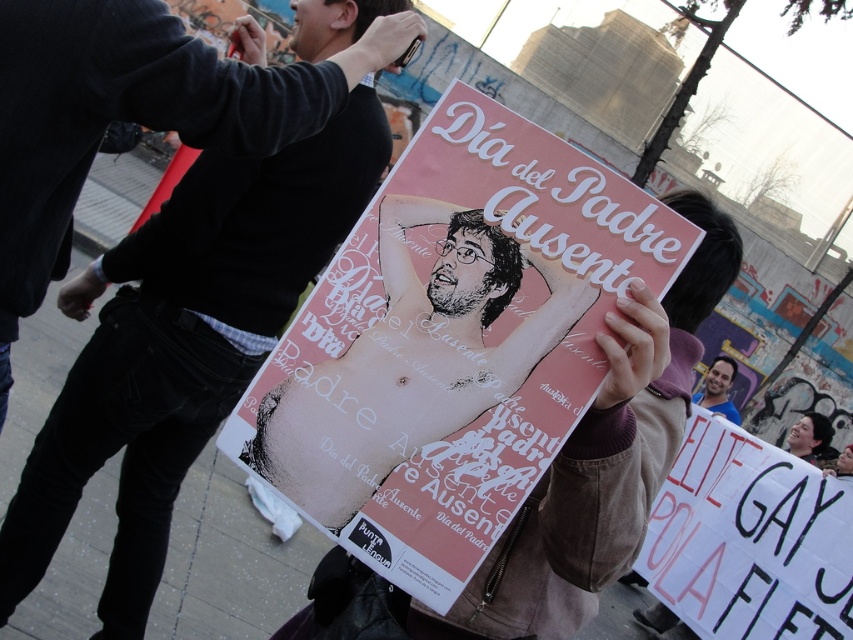
Question: Which of the following is the closest to the observer?

Choices:
 (A) (337, 465)
 (B) (727, 522)

Answer: (A)

Question: Which object is closer to the camera taking this photo?

Choices:
 (A) smooth skin face at center
 (B) white paper sign at lower right

Answer: (B)

Question: Considering the real-world distances, which object is farthest from the white paper sign at lower right?

Choices:
 (A) matte black poster at center
 (B) smooth skin face at center
 (C) matte pink poster at center

Answer: (C)

Question: From the image, what is the correct spatial relationship of matte pink poster at center in relation to smooth skin face at center?

Choices:
 (A) left
 (B) right

Answer: (A)

Question: Does matte pink poster at center have a smaller size compared to white paper sign at lower right?

Choices:
 (A) yes
 (B) no

Answer: (A)

Question: Does pink paper poster at center come behind matte black poster at center?

Choices:
 (A) yes
 (B) no

Answer: (B)